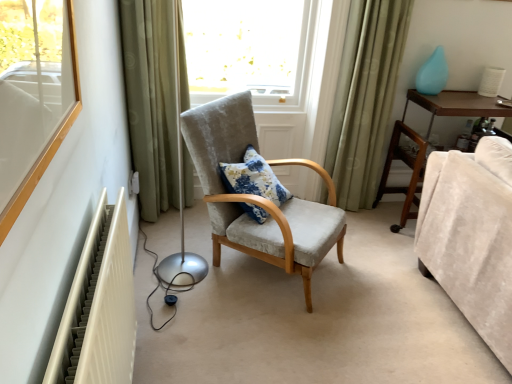
Question: Does brown wooden dresser at right lie in front of velvet beige couch at lower right?

Choices:
 (A) no
 (B) yes

Answer: (A)

Question: Considering the relative sizes of brown wooden dresser at right and velvet beige couch at lower right in the image provided, is brown wooden dresser at right taller than velvet beige couch at lower right?

Choices:
 (A) yes
 (B) no

Answer: (A)

Question: From a real-world perspective, is brown wooden dresser at right on top of velvet beige couch at lower right?

Choices:
 (A) yes
 (B) no

Answer: (B)

Question: Would you say brown wooden dresser at right contains velvet beige couch at lower right?

Choices:
 (A) no
 (B) yes

Answer: (A)

Question: From the image's perspective, is brown wooden dresser at right above velvet beige couch at lower right?

Choices:
 (A) no
 (B) yes

Answer: (B)

Question: Considering the relative sizes of brown wooden dresser at right and velvet beige couch at lower right in the image provided, is brown wooden dresser at right thinner than velvet beige couch at lower right?

Choices:
 (A) no
 (B) yes

Answer: (B)

Question: Could white plastic electric outlet at lower left be considered to be inside green fabric curtain at left, the second curtain positioned from the right?

Choices:
 (A) no
 (B) yes

Answer: (A)

Question: Is green fabric curtain at left, the second curtain positioned from the right, to the left of white plastic electric outlet at lower left from the viewer's perspective?

Choices:
 (A) no
 (B) yes

Answer: (A)

Question: Is green fabric curtain at left, the second curtain positioned from the right, further to the viewer compared to white plastic electric outlet at lower left?

Choices:
 (A) no
 (B) yes

Answer: (A)

Question: Is green fabric curtain at left, the second curtain positioned from the right, touching white plastic electric outlet at lower left?

Choices:
 (A) no
 (B) yes

Answer: (A)

Question: Is green fabric curtain at left, the second curtain positioned from the right, far from white plastic electric outlet at lower left?

Choices:
 (A) yes
 (B) no

Answer: (B)

Question: Does green fabric curtain at left, the second curtain positioned from the right, have a greater width compared to white plastic electric outlet at lower left?

Choices:
 (A) yes
 (B) no

Answer: (A)

Question: From the image's perspective, is white plastic electric outlet at lower left located beneath teal glossy vase at upper right?

Choices:
 (A) no
 (B) yes

Answer: (B)